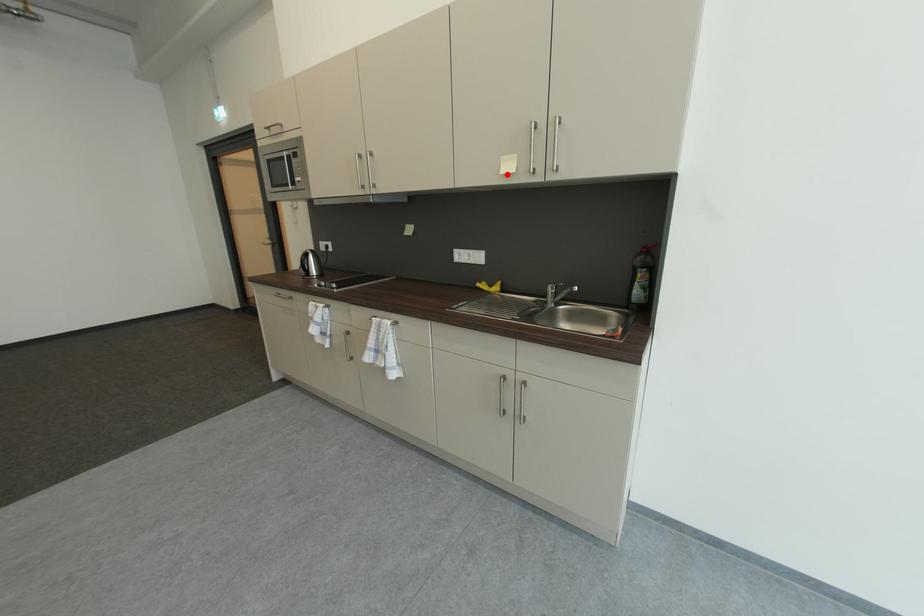
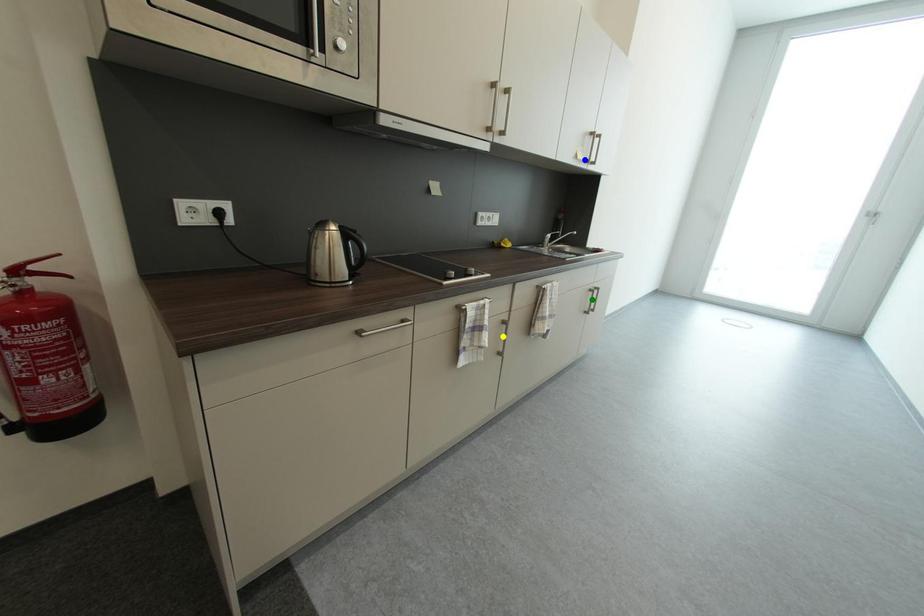
Question: I am providing you with two images of the same scene from different viewpoints. A red point is marked on the first image. You are given multiple points on the second image. In image 2, which mark is for the same physical point as the one in image 1?

Choices:
 (A) yellow point
 (B) green point
 (C) blue point

Answer: (C)